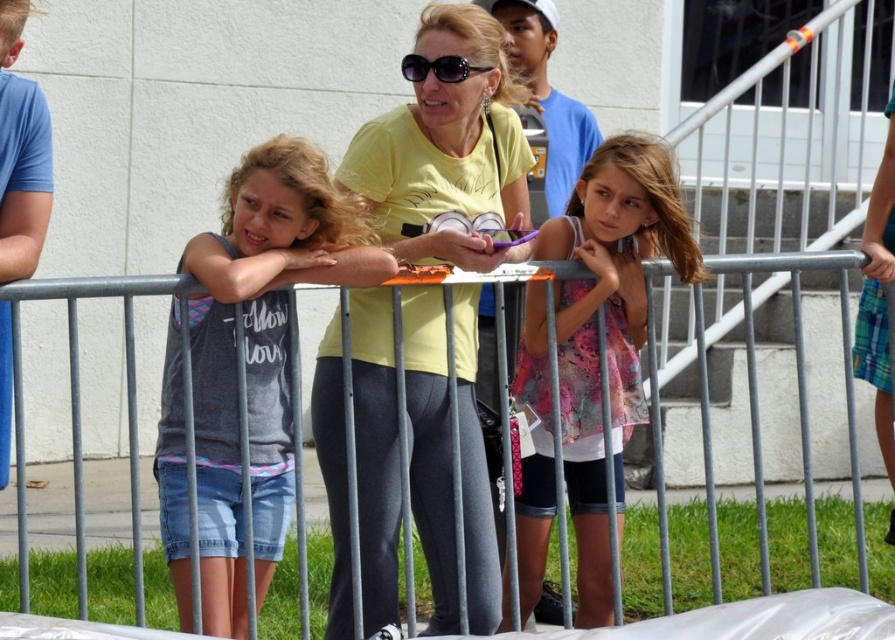
You are a photographer trying to capture a clear shot of the denim shorts at center and the metallic gray fence at center. Based on their positions, which object should you focus on first to ensure both are in focus?

The denim shorts at center is closer to the viewer than the metallic gray fence at center. To ensure both are in focus, you should focus on the metallic gray fence at center first since it is farther away, allowing the depth of field to cover the closer denim shorts at center.

You are a photographer trying to capture a candid shot of the denim shorts at center and the black plastic sunglasses at center. You need to ensure both items are in focus. Your camera has a depth of field that can cover a maximum distance of 1.5 meters between objects. Will both items be in focus?

The denim shorts at center and the black plastic sunglasses at center are 1.44 meters apart from each other. Since the distance between them is less than the camera maximum depth of field of 1.5 meters, both items will be in focus.